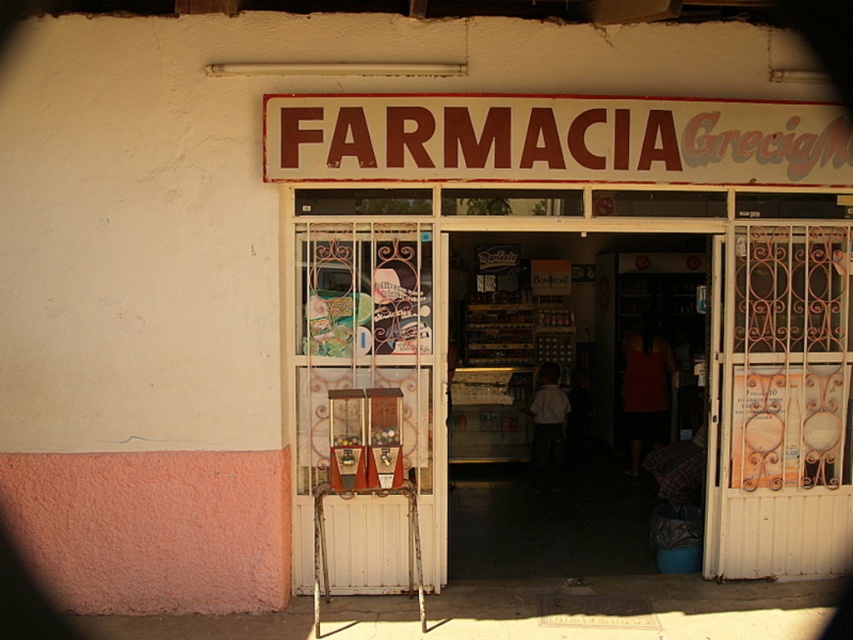
Question: Does white plastic vending machine at center appear on the right side of white wooden door at center?

Choices:
 (A) yes
 (B) no

Answer: (A)

Question: Which object is positioned farthest from the white painted metal gate at right?

Choices:
 (A) white plastic vending machine at center
 (B) white wooden door at center
 (C) brown painted signboard at center

Answer: (B)

Question: Which object appears farthest from the camera in this image?

Choices:
 (A) brown painted signboard at center
 (B) white painted metal gate at right
 (C) white plastic vending machine at center
 (D) white wooden door at center

Answer: (B)

Question: Does white plastic vending machine at center come behind brown painted signboard at center?

Choices:
 (A) yes
 (B) no

Answer: (A)

Question: Where is white plastic vending machine at center located in relation to white wooden door at center in the image?

Choices:
 (A) above
 (B) below

Answer: (A)

Question: Among these points, which one is farthest from the camera?

Choices:
 (A) (395, 321)
 (B) (712, 384)

Answer: (B)